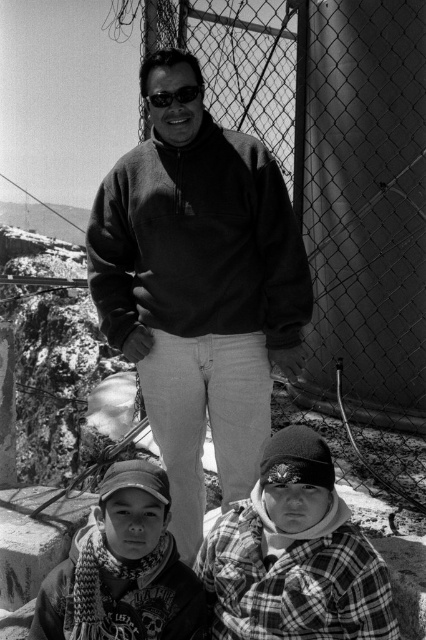
Question: Is dark fleece at center to the left of plaid fabric shirt at lower center from the viewer's perspective?

Choices:
 (A) no
 (B) yes

Answer: (A)

Question: Is plaid flannel shirt at lower right closer to camera compared to plaid fabric shirt at lower center?

Choices:
 (A) no
 (B) yes

Answer: (B)

Question: Which object is farther from the camera taking this photo?

Choices:
 (A) matte black sweatshirt at center
 (B) plaid flannel shirt at lower right

Answer: (A)

Question: Which object is closer to the camera taking this photo?

Choices:
 (A) dark fleece at center
 (B) matte black goggles at center
 (C) plaid fabric shirt at lower center
 (D) plaid flannel shirt at lower right

Answer: (D)

Question: Which of these objects is positioned closest to the matte black sweatshirt at center?

Choices:
 (A) dark fleece at center
 (B) matte black goggles at center

Answer: (A)

Question: In this image, where is plaid flannel shirt at lower right located relative to plaid fabric shirt at lower center?

Choices:
 (A) below
 (B) above

Answer: (B)